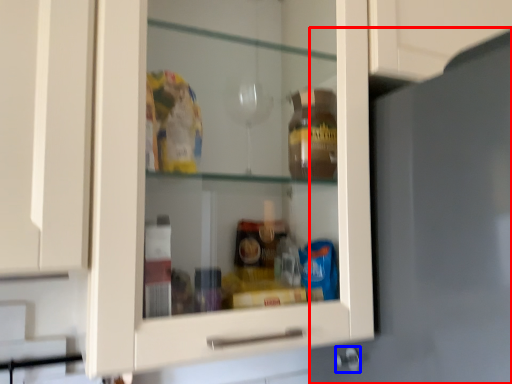
Question: Which object appears closest to the camera in this image, door (highlighted by a red box) or knob (highlighted by a blue box)?

Choices:
 (A) door
 (B) knob

Answer: (A)